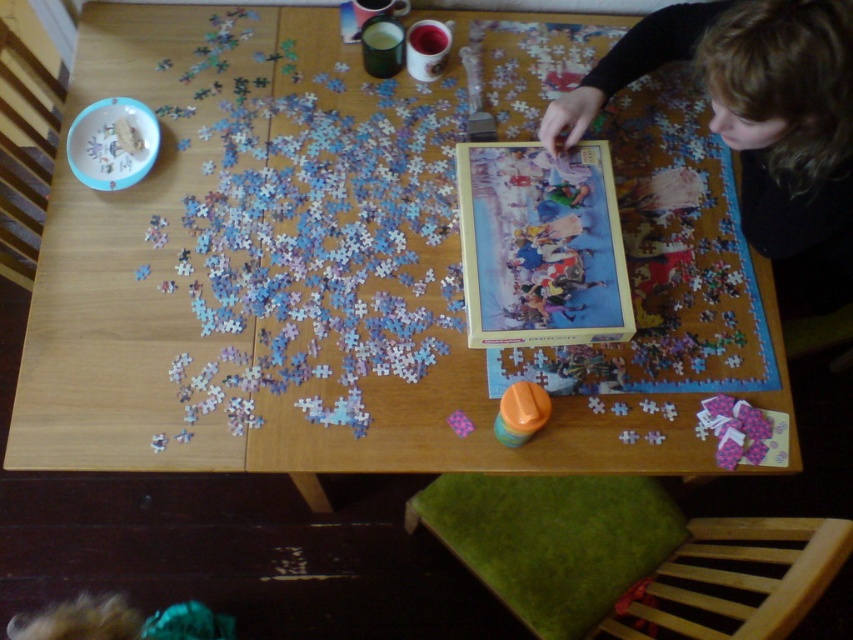
Question: Which point appears farthest from the camera in this image?

Choices:
 (A) (200, 422)
 (B) (781, 13)

Answer: (A)

Question: Is wooden table at center above blonde hair at upper right?

Choices:
 (A) no
 (B) yes

Answer: (A)

Question: Among these points, which one is farthest from the camera?

Choices:
 (A) coord(288,342)
 (B) coord(722,52)

Answer: (A)

Question: Considering the relative positions of wooden table at center and blonde hair at upper right in the image provided, where is wooden table at center located with respect to blonde hair at upper right?

Choices:
 (A) below
 (B) above

Answer: (A)

Question: Does wooden table at center appear under blonde hair at upper right?

Choices:
 (A) yes
 (B) no

Answer: (A)

Question: Which point is farther from the camera taking this photo?

Choices:
 (A) (554, 104)
 (B) (485, 429)

Answer: (A)